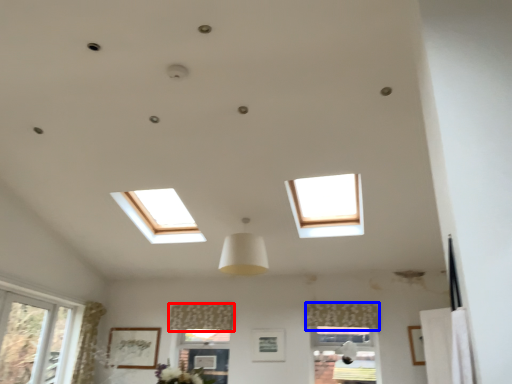
Question: Among these objects, which one is farthest to the camera, curtain (highlighted by a red box) or curtain (highlighted by a blue box)?

Choices:
 (A) curtain
 (B) curtain

Answer: (A)